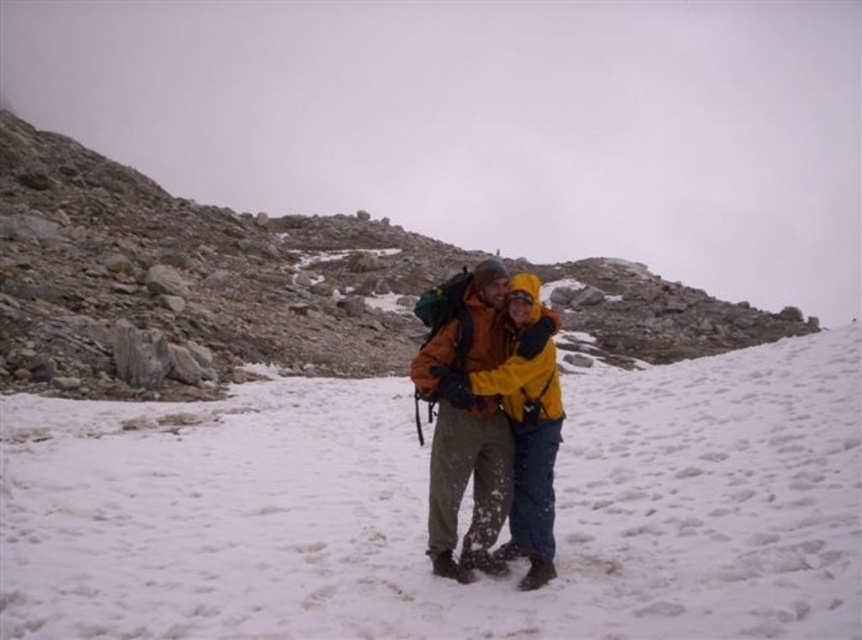
From the picture: Who is positioned more to the right, rough stone mountain at center or orange softshell jacket at center?

Positioned to the right is orange softshell jacket at center.

Which of these two, rough stone mountain at center or orange softshell jacket at center, stands shorter?

orange softshell jacket at center

Between point (107, 230) and point (484, 397), which one is positioned in front?

Positioned in front is point (484, 397).

Identify the location of rough stone mountain at center. (189, 273).

Can you confirm if white powdery snow at center is positioned to the left of orange softshell jacket at center?

In fact, white powdery snow at center is to the right of orange softshell jacket at center.

Between white powdery snow at center and orange softshell jacket at center, which one has more height?

Standing taller between the two is orange softshell jacket at center.

Find the location of a particular element. Image resolution: width=862 pixels, height=640 pixels. white powdery snow at center is located at coordinates (425, 508).

At what (x,y) coordinates should I click in order to perform the action: click on white powdery snow at center. Please return your answer as a coordinate pair (x, y). Looking at the image, I should click on (425, 508).

Where is `white powdery snow at center`? white powdery snow at center is located at coordinates (425, 508).